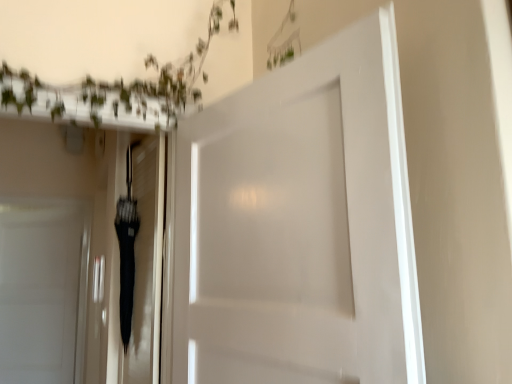
Question: Does black glossy umbrella at center have a larger size compared to white matte door at left, the first door positioned from the back?

Choices:
 (A) no
 (B) yes

Answer: (A)

Question: Is black glossy umbrella at center shorter than white matte door at left, arranged as the second door when viewed from the right?

Choices:
 (A) yes
 (B) no

Answer: (A)

Question: From a real-world perspective, is black glossy umbrella at center located higher than white matte door at left, arranged as the second door when viewed from the right?

Choices:
 (A) no
 (B) yes

Answer: (B)

Question: Is black glossy umbrella at center facing towards white matte door at left, arranged as the second door when viewed from the right?

Choices:
 (A) no
 (B) yes

Answer: (A)

Question: From the image's perspective, is black glossy umbrella at center beneath white matte door at left, the first door positioned from the back?

Choices:
 (A) yes
 (B) no

Answer: (B)

Question: Is black glossy umbrella at center facing away from white matte door at left, arranged as the first door when viewed from the left?

Choices:
 (A) no
 (B) yes

Answer: (A)

Question: Does white matte door at center, placed as the first door when sorted from right to left, lie behind black glossy umbrella at center?

Choices:
 (A) no
 (B) yes

Answer: (A)

Question: Are white matte door at center, acting as the 1th door starting from the front, and black glossy umbrella at center located far from each other?

Choices:
 (A) yes
 (B) no

Answer: (B)

Question: Does white matte door at center, positioned as the second door in left-to-right order, appear on the left side of black glossy umbrella at center?

Choices:
 (A) yes
 (B) no

Answer: (B)

Question: From the image's perspective, does white matte door at center, placed as the first door when sorted from right to left, appear higher than black glossy umbrella at center?

Choices:
 (A) no
 (B) yes

Answer: (B)

Question: From a real-world perspective, is white matte door at center, acting as the 1th door starting from the front, beneath black glossy umbrella at center?

Choices:
 (A) yes
 (B) no

Answer: (B)

Question: Is white matte door at center, acting as the 1th door starting from the front, thinner than black glossy umbrella at center?

Choices:
 (A) no
 (B) yes

Answer: (A)

Question: Can you confirm if black glossy umbrella at center is shorter than white matte door at center, the second door from the back?

Choices:
 (A) no
 (B) yes

Answer: (A)